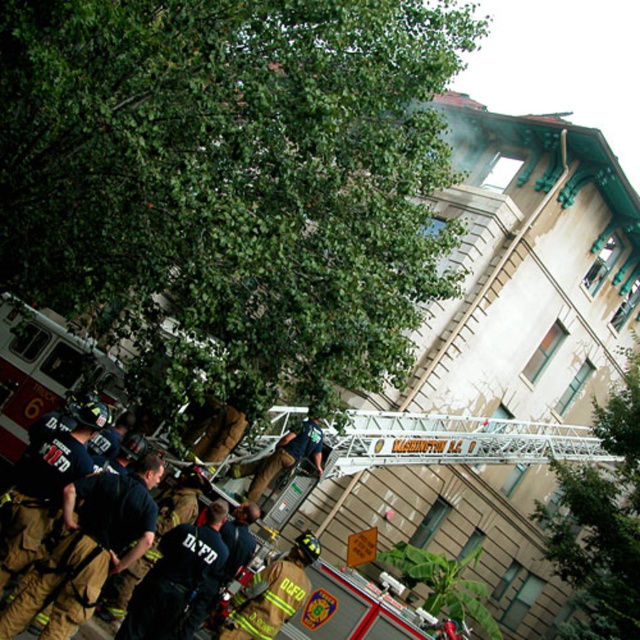
You are a firefighter trying to locate your team member wearing the dark brown uniform at lower left. Where would you look relative to the point at coordinates point (x=96, y=547)?

The point at coordinates point (x=96, y=547) is on the dark brown uniform at lower left, so you should look directly at that point to find your team member.

You are a photographer standing at the location of the camera in the scene. You want to capture a closeup shot of the dark brown uniform at lower left. Given that your camera has a maximum zoom range of 100 feet, will you be able to get a clear closeup without moving closer?

The dark brown uniform at lower left and camera are 91.79 feet apart. Since the camera has a maximum zoom range of 100 feet, you can capture a clear closeup without moving closer because the distance is within the zoom capability.